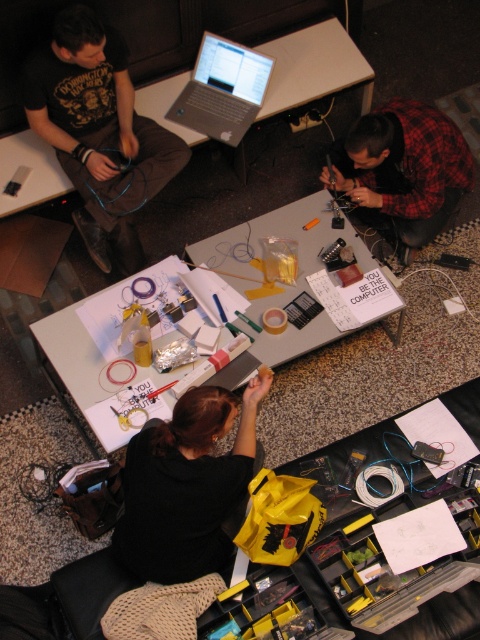
Question: Which object is farther from the camera taking this photo?

Choices:
 (A) white paper at center
 (B) yellow fabric bag at center
 (C) black matte shirt at center

Answer: (A)

Question: Which object is farther from the camera taking this photo?

Choices:
 (A) silver metallic laptop at center
 (B) black matte shirt at center
 (C) white paper at center

Answer: (A)

Question: Is white paper at center closer to camera compared to matte black shirt at upper left?

Choices:
 (A) yes
 (B) no

Answer: (A)

Question: Is matte black shirt at upper left positioned behind black matte shirt at center?

Choices:
 (A) yes
 (B) no

Answer: (A)

Question: Which point is farther to the camera?

Choices:
 (A) (84, 332)
 (B) (145, 157)

Answer: (B)

Question: In this image, where is black matte shirt at center located relative to silver metallic laptop at center?

Choices:
 (A) below
 (B) above

Answer: (A)